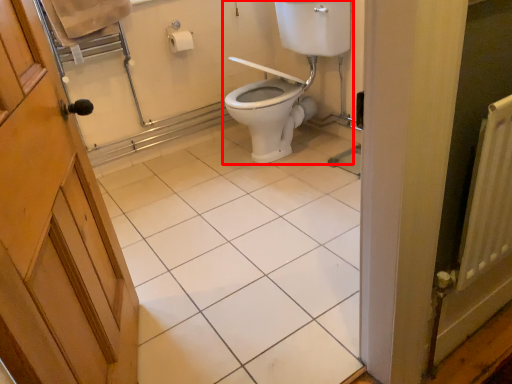
Question: Considering the relative positions of sink (annotated by the red box) and tile in the image provided, where is sink (annotated by the red box) located with respect to the staircase?

Choices:
 (A) right
 (B) left

Answer: (A)